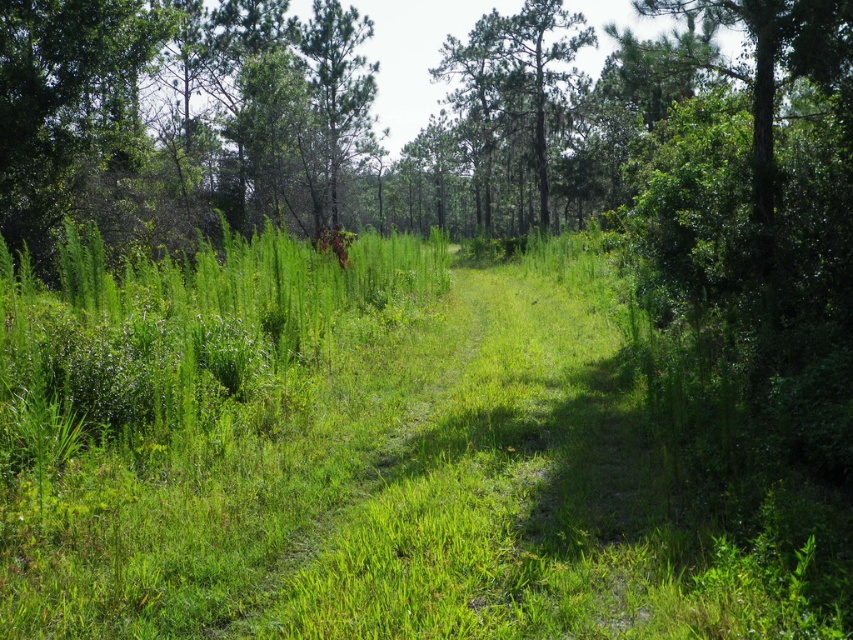
You are standing at the start of the grassy path and want to reach the green leafy tree at center. Which direction should you walk to get there?

The green leafy tree at center is located at point (x=514, y=83), so you should walk towards the center of the image to reach it.

You are a hiker standing on the grassy path and want to take a photo of both the green leafy tree at center and the green rough bark tree at upper center. Which tree should you position yourself closer to in order to capture both in the same frame?

You should position yourself closer to the green rough bark tree at upper center because the green leafy tree at center is to the right of it, so by moving towards the left tree, you can include both in your camera frame.

You are standing at the point marked as point (540, 102) in the image. There is another point 133.88 feet away from you. If you want to walk directly to that point, which direction should you head relative to the grassy path?

The other point is 133.88 feet away from point (540, 102). Since the path meanders through the landscape, you would need to walk perpendicular to the path to reach the distant point directly.